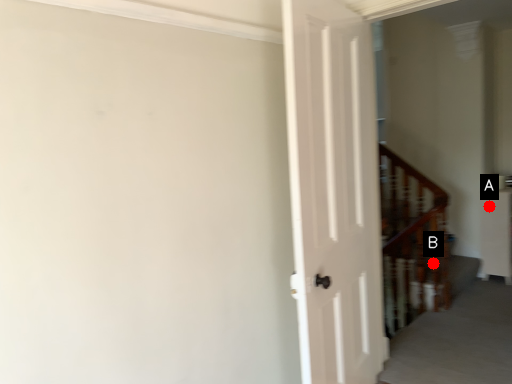
Question: Two points are circled on the image, labeled by A and B beside each circle. Which of the following is the closest to the observer?

Choices:
 (A) A is closer
 (B) B is closer

Answer: (B)